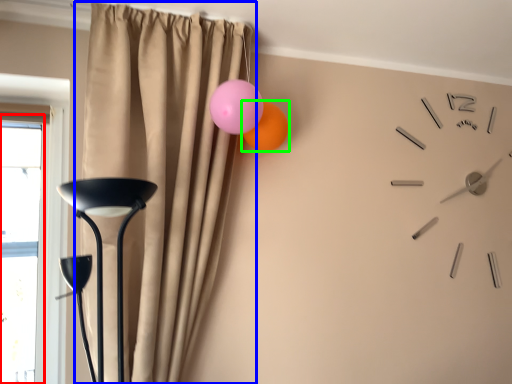
Question: Which object is the closest to the window (highlighted by a red box)? Choose among these: curtain (highlighted by a blue box) or balloon (highlighted by a green box).

Choices:
 (A) curtain
 (B) balloon

Answer: (A)